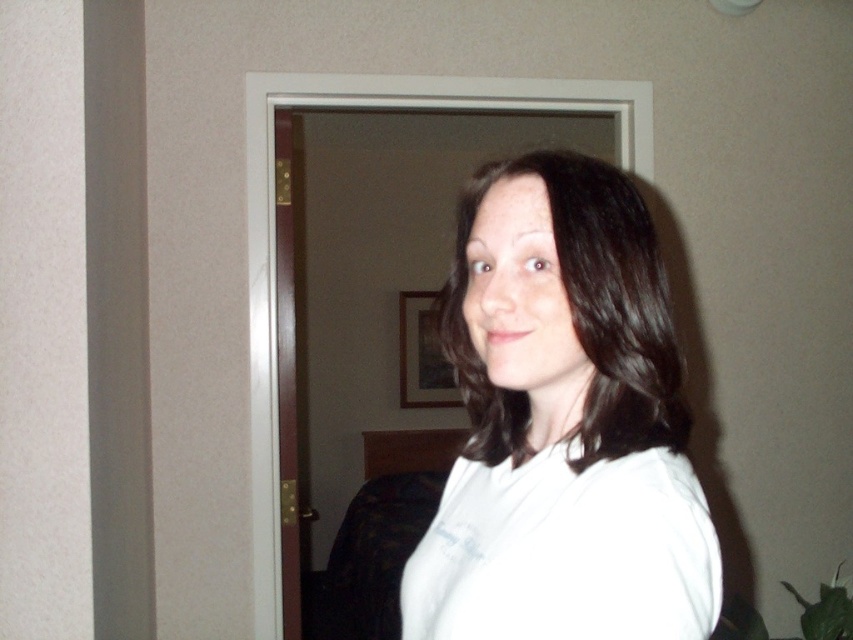
You are trying to decide which white shirt to wear for an event. You see the white matte shirt at center and the white cotton shirt at center in the image. Which one is closer to you?

The white matte shirt at center is closer to you than the white cotton shirt at center.

You are a photographer trying to capture a closeup of the white matte shirt at center and the white cotton shirt at center. Which shirt should you focus on if you want to capture the one that is more to the left?

The white matte shirt at center is positioned on the left side of the white cotton shirt at center, so you should focus on the white matte shirt at center to capture the one more to the left.

You are a photographer adjusting the camera settings to capture the scene. You notice two shirts at the center of the image, a white matte shirt at center and a white cotton shirt at center. Which shirt is closer to the camera?

The white matte shirt at center and white cotton shirt at center are 5.28 centimeters apart from each other, but the description does not specify which one is closer. Therefore, it is impossible to determine which shirt is closer based on the given information.